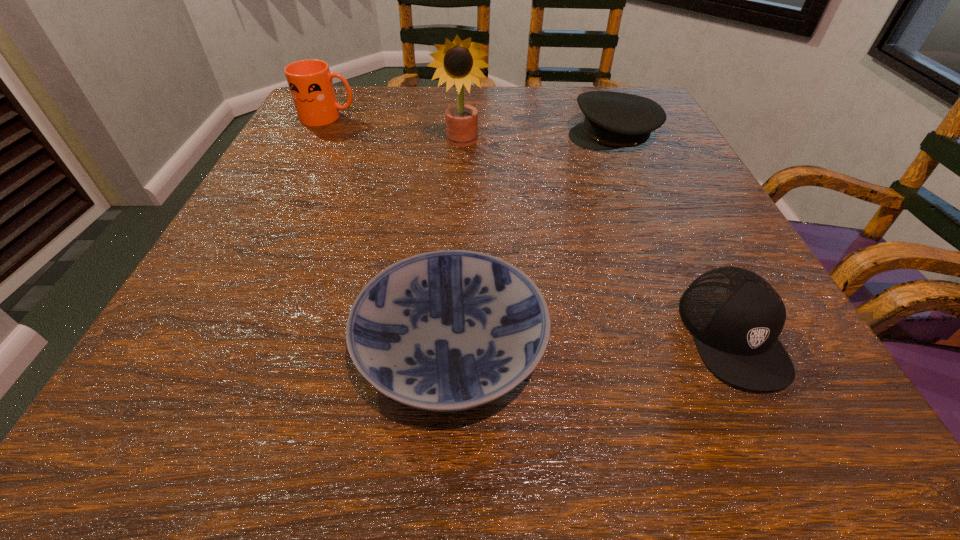
At what (x,y) coordinates should I click in order to perform the action: click on vacant space located on the front-facing side of the beret. Please return your answer as a coordinate pair (x, y). Image resolution: width=960 pixels, height=540 pixels. Looking at the image, I should click on (435, 137).

This screenshot has width=960, height=540. I want to click on free region located on the back of the plate, so click(x=462, y=147).

Where is `sunflower located at the far edge`? The width and height of the screenshot is (960, 540). sunflower located at the far edge is located at coordinates (458, 62).

Find the location of a particular element. The height and width of the screenshot is (540, 960). mug located at the far edge is located at coordinates (310, 82).

I want to click on beret present at the far edge, so click(613, 120).

Locate an element on the screen. This screenshot has height=540, width=960. cap that is positioned at the near edge is located at coordinates (735, 316).

Locate an element on the screen. This screenshot has height=540, width=960. plate at the near edge is located at coordinates tap(452, 330).

I want to click on object located in the left edge section of the desktop, so click(310, 82).

Where is `beret that is at the right edge`? This screenshot has height=540, width=960. beret that is at the right edge is located at coordinates (613, 120).

Locate an element on the screen. The height and width of the screenshot is (540, 960). cap at the right edge is located at coordinates (735, 316).